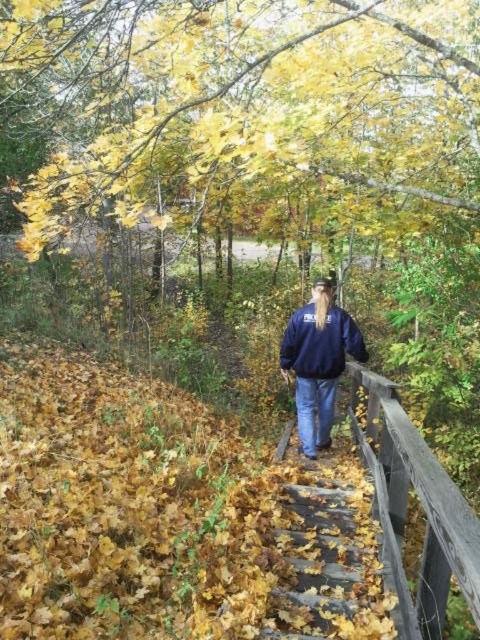
Is point (417, 612) closer to viewer compared to point (334, 307)?

Yes, it is.

The image size is (480, 640). I want to click on wooden rail at right, so click(422, 508).